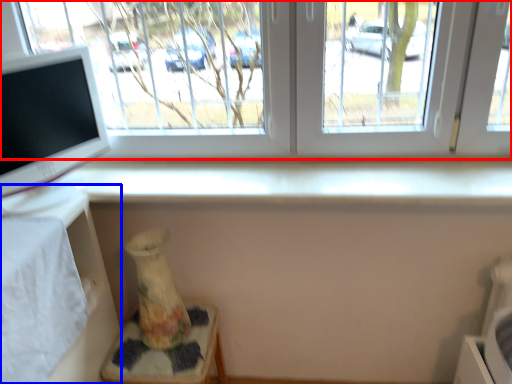
Question: Which object is further to the camera taking this photo, window (highlighted by a red box) or table (highlighted by a blue box)?

Choices:
 (A) window
 (B) table

Answer: (A)